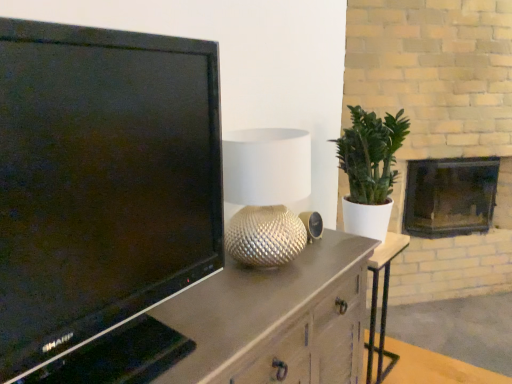
The height and width of the screenshot is (384, 512). I want to click on free space in front of silver textured lamp at center, so click(x=272, y=297).